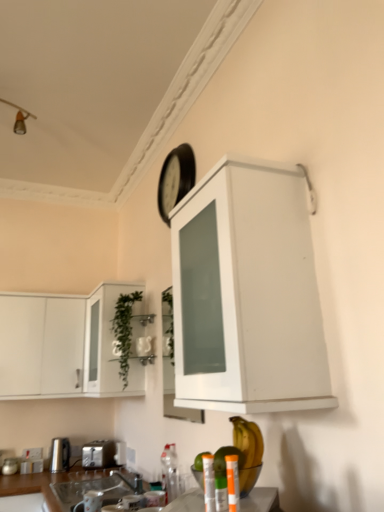
Question: In terms of height, does translucent plastic bottle at lower center, the 1th bottle viewed from the right, look taller or shorter compared to green glass cabinet at left, which is counted as the third cabinetry, starting from the right?

Choices:
 (A) short
 (B) tall

Answer: (A)

Question: Looking at their shapes, would you say translucent plastic bottle at lower center, the second bottle viewed from the left, is wider or thinner than green glass cabinet at left, which is counted as the third cabinetry, starting from the right?

Choices:
 (A) thin
 (B) wide

Answer: (A)

Question: Estimate the real-world distances between objects in this image. Which object is closer to the black matte clock at upper center?

Choices:
 (A) green glass cabinet at left, which is counted as the third cabinetry, starting from the right
 (B) yellow matte banana at lower center
 (C) translucent plastic bottles at lower center, marked as the 4th appliance in a left-to-right arrangement
 (D) white matte cabinet at upper center, arranged as the first cabinetry when viewed from the right
 (E) satin silver toaster at lower center, marked as the second appliance in a bottom-to-top arrangement

Answer: (A)

Question: Based on their relative distances, which object is farther from the brushed metal toaster at lower left, which is counted as the 4th appliance, starting from the right?

Choices:
 (A) black matte clock at upper center
 (B) clear glass sink at lower center
 (C) white glossy cabinet at left, marked as the 4th cabinetry in a right-to-left arrangement
 (D) silver metallic faucet at lower center
 (E) white matte cabinet at upper center, which ranks as the 4th cabinetry in left-to-right order

Answer: (A)